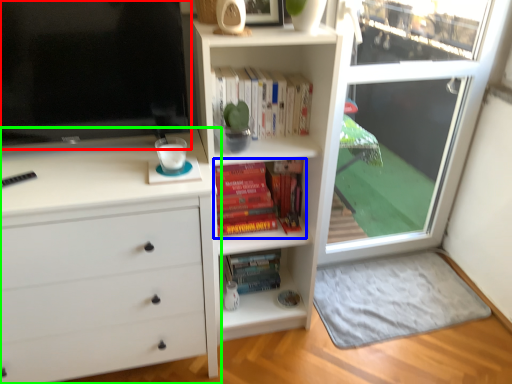
Question: Which object is the closest to the television (highlighted by a red box)? Choose among these: book (highlighted by a blue box) or chest of drawers (highlighted by a green box).

Choices:
 (A) book
 (B) chest of drawers

Answer: (B)